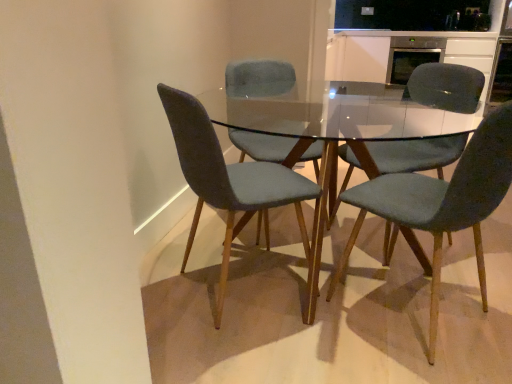
The height and width of the screenshot is (384, 512). I want to click on space that is in front of velvet grey chair at center, positioned as the 4th chair in right-to-left order, so click(x=256, y=350).